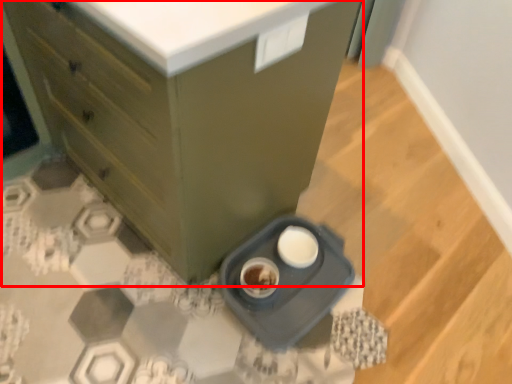
Question: Where is chest of drawers (annotated by the red box) located in relation to appliance in the image?

Choices:
 (A) right
 (B) left

Answer: (B)